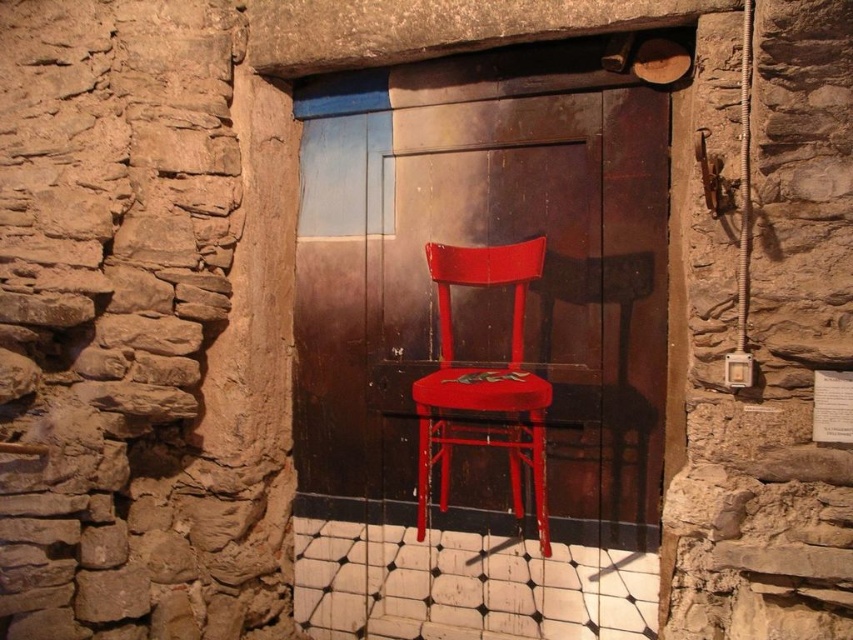
Which is behind, point (422, 134) or point (517, 339)?

The point (422, 134) is more distant.

Between matte wood door at center and matte red chair at center, which one appears on the left side from the viewer's perspective?

Positioned to the left is matte wood door at center.

Describe the element at coordinates (482, 244) in the screenshot. I see `matte wood door at center` at that location.

Where is `matte wood door at center`? The height and width of the screenshot is (640, 853). matte wood door at center is located at coordinates (482, 244).